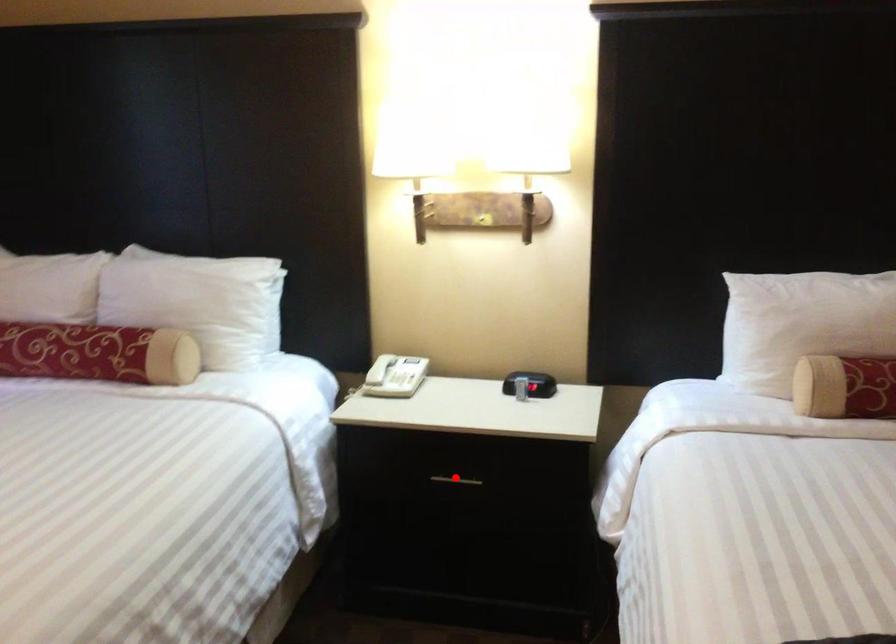
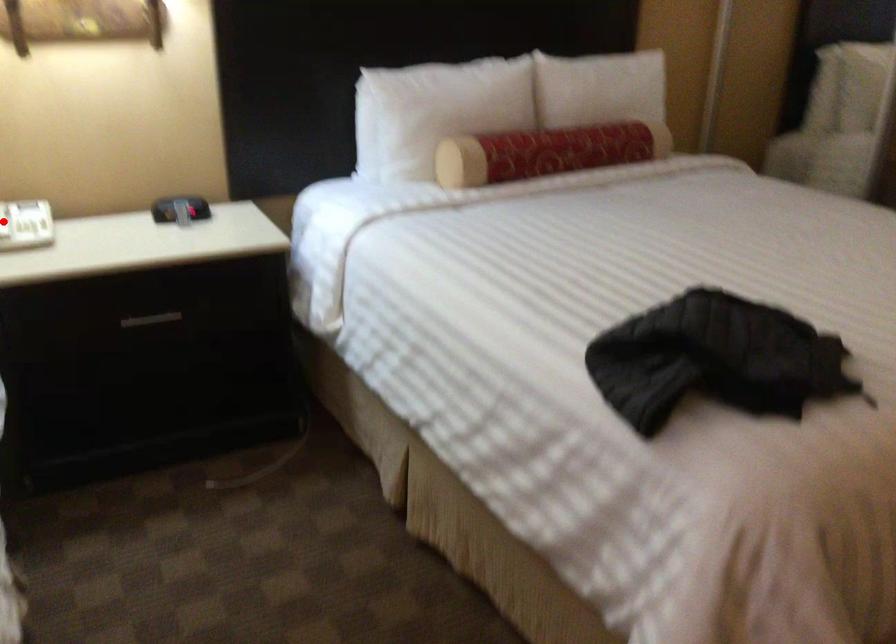
I am providing you with two images of the same scene from different viewpoints. A red point is marked on the first image and another point is marked on the second image. Do the highlighted points in image1 and image2 indicate the same real-world spot?

No